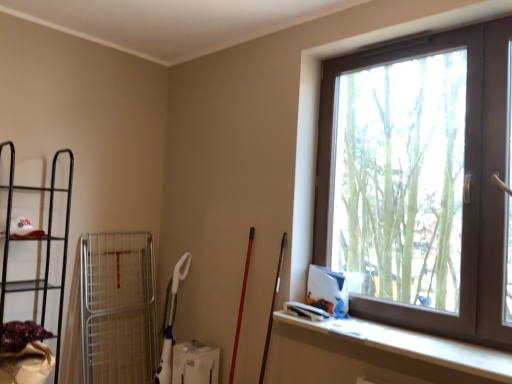
Question: Is point (65, 261) closer or farther from the camera than point (437, 349)?

Choices:
 (A) farther
 (B) closer

Answer: (A)

Question: Would you say black metal shelf at left is to the left or to the right of white matte ledge at lower right in the picture?

Choices:
 (A) left
 (B) right

Answer: (A)

Question: Considering the real-world distances, which object is farthest from the brown plastic window at upper right?

Choices:
 (A) white matte ledge at lower right
 (B) black metal shelf at left

Answer: (B)

Question: Estimate the real-world distances between objects in this image. Which object is farther from the brown plastic window at upper right?

Choices:
 (A) white matte ledge at lower right
 (B) black metal shelf at left

Answer: (B)